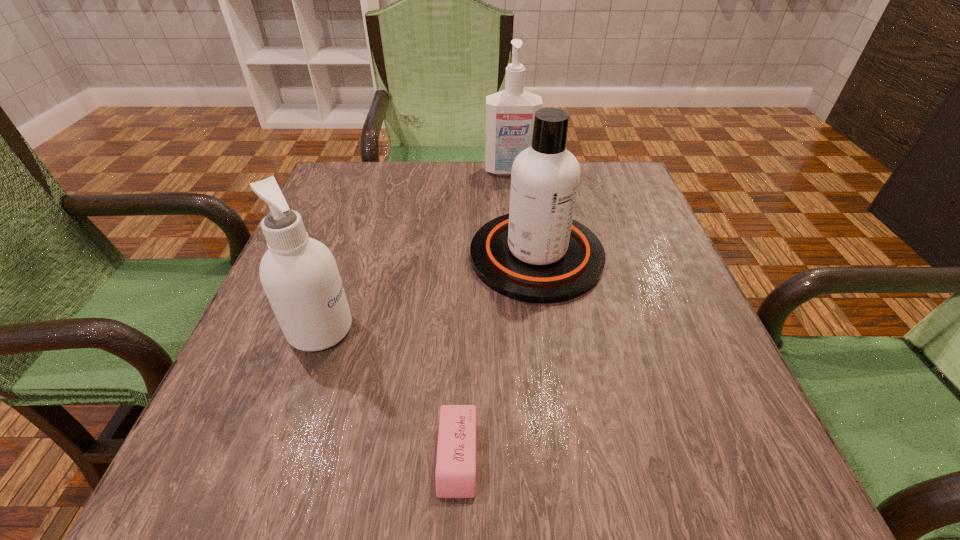
Where is `cleansing agent that is the second closest to the second farthest object`? This screenshot has width=960, height=540. cleansing agent that is the second closest to the second farthest object is located at coordinates (299, 274).

Locate which cleansing agent is the closest to the farthest object. Please provide its 2D coordinates. Your answer should be formatted as a tuple, i.e. [(x, y)], where the tuple contains the x and y coordinates of a point satisfying the conditions above.

[(537, 253)]

This screenshot has height=540, width=960. What are the coordinates of `vacant space that satisfies the following two spatial constraints: 1. on the front label of the farthest object; 2. on the left side of the second nearest cleansing agent` in the screenshot? It's located at (519, 256).

The width and height of the screenshot is (960, 540). I want to click on vacant space that satisfies the following two spatial constraints: 1. on the front label of the shortest object; 2. on the right side of the nearest cleansing agent, so click(x=276, y=456).

Locate an element on the screen. The image size is (960, 540). free space that satisfies the following two spatial constraints: 1. on the front label of the second farthest object; 2. on the right side of the farthest object is located at coordinates (519, 256).

Find the location of a particular element. This screenshot has width=960, height=540. free location that satisfies the following two spatial constraints: 1. on the front label of the farthest object; 2. on the left side of the second farthest object is located at coordinates (519, 256).

Locate an element on the screen. This screenshot has height=540, width=960. vacant point that satisfies the following two spatial constraints: 1. on the front label of the leftmost object; 2. on the left side of the eraser is located at coordinates (276, 456).

Find the location of a particular element. This screenshot has width=960, height=540. free space in the image that satisfies the following two spatial constraints: 1. on the front label of the leftmost cleansing agent; 2. on the left side of the nearest object is located at coordinates (276, 456).

You are a GUI agent. You are given a task and a screenshot of the screen. Output one action in this format:
    pyautogui.click(x=<x>, y=<y>)
    Task: Click on the vacant position in the image that satisfies the following two spatial constraints: 1. on the front label of the farthest object; 2. on the front label of the leftmost cleansing agent
    
    Given the screenshot: What is the action you would take?
    pyautogui.click(x=526, y=329)

This screenshot has width=960, height=540. Identify the location of vacant space that satisfies the following two spatial constraints: 1. on the front side of the second farthest object; 2. on the front label of the leftmost object. (547, 329).